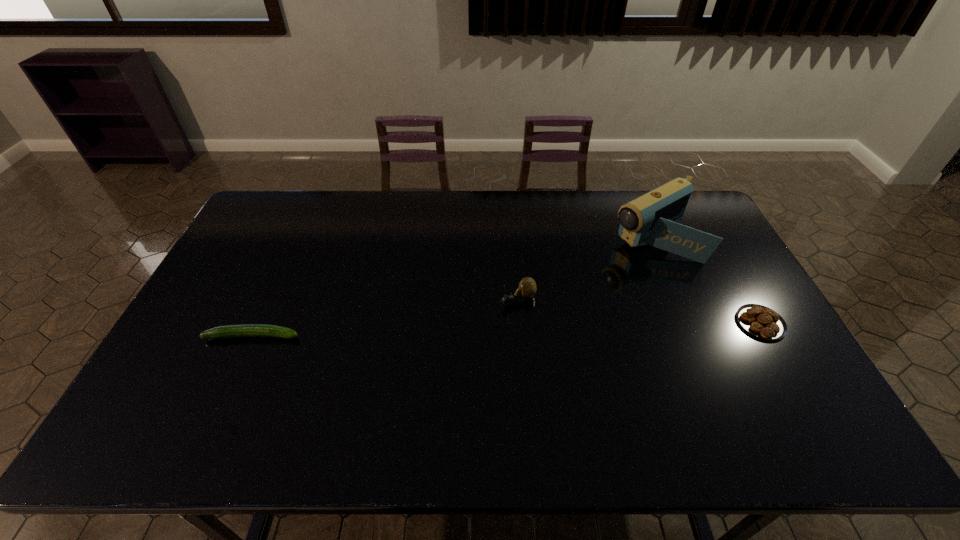
Where is `blank space at the near edge`? This screenshot has height=540, width=960. blank space at the near edge is located at coordinates (443, 397).

Locate an element on the screen. free region at the left edge of the desktop is located at coordinates (243, 248).

In the image, there is a desktop. At what (x,y) coordinates should I click in order to perform the action: click on vacant space at the right edge. Please return your answer as a coordinate pair (x, y). Image resolution: width=960 pixels, height=540 pixels. Looking at the image, I should click on (724, 241).

This screenshot has height=540, width=960. In order to click on free space at the far left corner of the desktop in this screenshot , I will do `click(292, 209)`.

Where is `free space that is in between the second tallest object and the zucchini`? The height and width of the screenshot is (540, 960). free space that is in between the second tallest object and the zucchini is located at coordinates (385, 318).

You are a GUI agent. You are given a task and a screenshot of the screen. Output one action in this format:
    pyautogui.click(x=<x>, y=<y>)
    Task: Click on the free area in between the second tallest object and the pastry
    The height and width of the screenshot is (540, 960).
    Given the screenshot: What is the action you would take?
    click(638, 312)

I want to click on vacant area that lies between the third object from right to left and the pastry, so click(x=638, y=312).

What are the coordinates of `blank region between the leftmost object and the farthest object` in the screenshot? It's located at (452, 287).

Locate an element on the screen. The height and width of the screenshot is (540, 960). free space that is in between the pastry and the tallest object is located at coordinates (706, 280).

I want to click on vacant point located between the leftmost object and the farthest object, so click(452, 287).